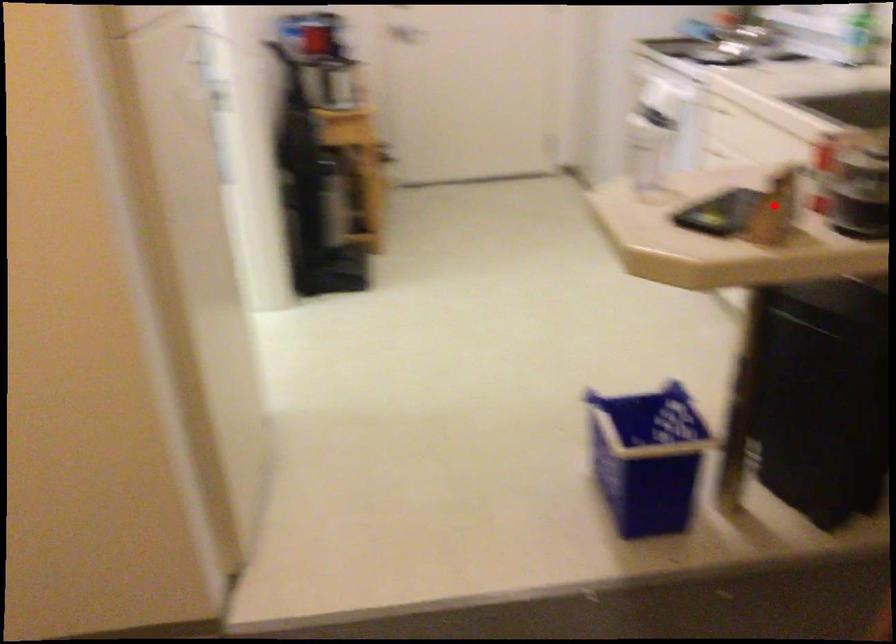
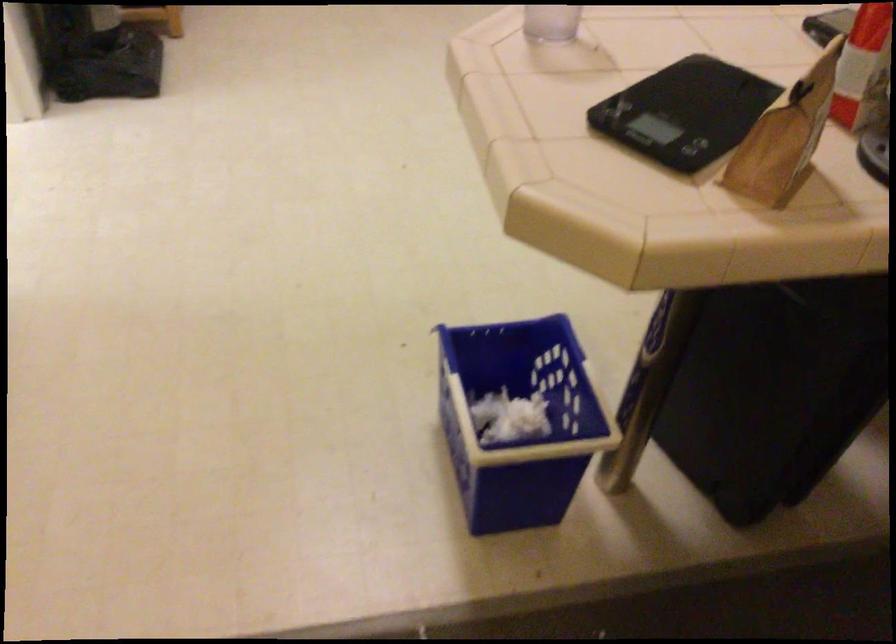
Where in the second image is the point corresponding to the highlighted location from the first image?

(785, 137)